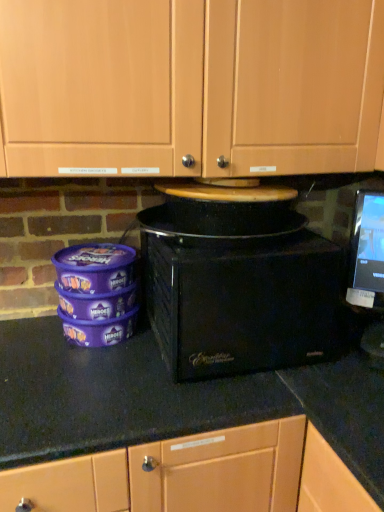
Question: Is black plastic microwave at center not close to wooden cabinet doors at upper center?

Choices:
 (A) yes
 (B) no

Answer: (B)

Question: Considering the relative sizes of black plastic microwave at center and wooden cabinet doors at upper center in the image provided, is black plastic microwave at center shorter than wooden cabinet doors at upper center?

Choices:
 (A) yes
 (B) no

Answer: (A)

Question: Is wooden cabinet doors at upper center located within black plastic microwave at center?

Choices:
 (A) yes
 (B) no

Answer: (B)

Question: From a real-world perspective, is black plastic microwave at center under wooden cabinet doors at upper center?

Choices:
 (A) yes
 (B) no

Answer: (A)

Question: Considering the relative sizes of black plastic microwave at center and wooden cabinet doors at upper center in the image provided, is black plastic microwave at center thinner than wooden cabinet doors at upper center?

Choices:
 (A) no
 (B) yes

Answer: (A)

Question: Is black plastic microwave at center turned away from wooden cabinet doors at upper center?

Choices:
 (A) no
 (B) yes

Answer: (A)

Question: Is the position of wooden cabinet doors at upper center more distant than that of black plastic microwave at center?

Choices:
 (A) no
 (B) yes

Answer: (A)

Question: Does wooden cabinet doors at upper center appear on the right side of black plastic microwave at center?

Choices:
 (A) no
 (B) yes

Answer: (A)

Question: Is wooden cabinet doors at upper center to the left of black plastic microwave at center from the viewer's perspective?

Choices:
 (A) yes
 (B) no

Answer: (A)

Question: Is wooden cabinet doors at upper center in contact with black plastic microwave at center?

Choices:
 (A) yes
 (B) no

Answer: (B)

Question: From a real-world perspective, is wooden cabinet doors at upper center on top of black plastic microwave at center?

Choices:
 (A) yes
 (B) no

Answer: (A)

Question: Considering the relative sizes of wooden cabinet doors at upper center and black plastic microwave at center in the image provided, is wooden cabinet doors at upper center thinner than black plastic microwave at center?

Choices:
 (A) yes
 (B) no

Answer: (A)

Question: Is point (226, 142) positioned closer to the camera than point (223, 215)?

Choices:
 (A) farther
 (B) closer

Answer: (B)